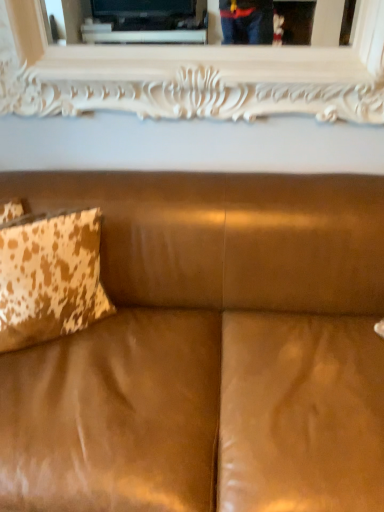
This screenshot has width=384, height=512. Describe the element at coordinates (50, 277) in the screenshot. I see `cowhide-patterned pillow at left` at that location.

Identify the location of white carved wood picture frame at upper center. The image size is (384, 512). (190, 74).

Is suede brown couch at center facing away from cowhide-patterned pillow at left?

Absolutely, suede brown couch at center is directed away from cowhide-patterned pillow at left.

From a real-world perspective, is suede brown couch at center positioned over cowhide-patterned pillow at left based on gravity?

Actually, suede brown couch at center is physically below cowhide-patterned pillow at left in the real world.

Is suede brown couch at center positioned beyond the bounds of cowhide-patterned pillow at left?

Yes, suede brown couch at center is not within cowhide-patterned pillow at left.

Which point is more forward, (149, 279) or (1, 293)?

The point (1, 293) is more forward.

Based on the photo, is cowhide-patterned pillow at left bigger than white carved wood picture frame at upper center?

No, cowhide-patterned pillow at left is not bigger than white carved wood picture frame at upper center.

Is point (27, 327) positioned after point (213, 58)?

No.

Is cowhide-patterned pillow at left behind white carved wood picture frame at upper center?

No, cowhide-patterned pillow at left is closer to the camera.

From the image's perspective, is cowhide-patterned pillow at left above white carved wood picture frame at upper center?

No, from the image's perspective, cowhide-patterned pillow at left is not over white carved wood picture frame at upper center.

Is suede brown couch at center beside white carved wood picture frame at upper center?

suede brown couch at center is not next to white carved wood picture frame at upper center, and they're not touching.

Does suede brown couch at center appear on the left side of white carved wood picture frame at upper center?

Indeed, suede brown couch at center is positioned on the left side of white carved wood picture frame at upper center.

Find the location of a particular element. The height and width of the screenshot is (512, 384). studio couch on the left of white carved wood picture frame at upper center is located at coordinates (208, 350).

Which is behind, cowhide-patterned pillow at left or suede brown couch at center?

cowhide-patterned pillow at left is behind.

Which is in front, point (72, 301) or point (336, 309)?

The point (72, 301) is closer.

In the scene shown: Is cowhide-patterned pillow at left facing away from suede brown couch at center?

Yes.

Which of these two, white carved wood picture frame at upper center or suede brown couch at center, stands taller?

suede brown couch at center.

Considering the relative sizes of white carved wood picture frame at upper center and suede brown couch at center in the image provided, is white carved wood picture frame at upper center smaller than suede brown couch at center?

Indeed, white carved wood picture frame at upper center has a smaller size compared to suede brown couch at center.

Is white carved wood picture frame at upper center to the right of suede brown couch at center from the viewer's perspective?

Indeed, white carved wood picture frame at upper center is positioned on the right side of suede brown couch at center.

Is white carved wood picture frame at upper center positioned with its back to suede brown couch at center?

No, white carved wood picture frame at upper center's orientation is not away from suede brown couch at center.

How distant is white carved wood picture frame at upper center from cowhide-patterned pillow at left?

white carved wood picture frame at upper center is 27.06 inches from cowhide-patterned pillow at left.

Is white carved wood picture frame at upper center inside or outside of cowhide-patterned pillow at left?

white carved wood picture frame at upper center exists outside the volume of cowhide-patterned pillow at left.

Is white carved wood picture frame at upper center positioned far away from cowhide-patterned pillow at left?

Actually, white carved wood picture frame at upper center and cowhide-patterned pillow at left are a little close together.

Find the location of a particular element. The height and width of the screenshot is (512, 384). pillow below the white carved wood picture frame at upper center (from the image's perspective) is located at coordinates (50, 277).

Where is `studio couch in front of the cowhide-patterned pillow at left`? studio couch in front of the cowhide-patterned pillow at left is located at coordinates (208, 350).

This screenshot has width=384, height=512. I want to click on picture frame located above the cowhide-patterned pillow at left (from a real-world perspective), so click(190, 74).

Estimate the real-world distances between objects in this image. Which object is further from white carved wood picture frame at upper center, cowhide-patterned pillow at left or suede brown couch at center?

The object further to white carved wood picture frame at upper center is cowhide-patterned pillow at left.

Which object lies further to the anchor point suede brown couch at center, cowhide-patterned pillow at left or white carved wood picture frame at upper center?

white carved wood picture frame at upper center is further to suede brown couch at center.

Estimate the real-world distances between objects in this image. Which object is closer to suede brown couch at center, white carved wood picture frame at upper center or cowhide-patterned pillow at left?

Among the two, cowhide-patterned pillow at left is located nearer to suede brown couch at center.

Looking at this image, from the image, which object appears to be nearer to white carved wood picture frame at upper center, suede brown couch at center or cowhide-patterned pillow at left?

suede brown couch at center.

Considering their positions, is white carved wood picture frame at upper center positioned further to cowhide-patterned pillow at left than suede brown couch at center?

white carved wood picture frame at upper center.

Estimate the real-world distances between objects in this image. Which object is closer to cowhide-patterned pillow at left, suede brown couch at center or white carved wood picture frame at upper center?

suede brown couch at center is positioned closer to the anchor cowhide-patterned pillow at left.

Where is `pillow between white carved wood picture frame at upper center and suede brown couch at center from top to bottom`? The image size is (384, 512). pillow between white carved wood picture frame at upper center and suede brown couch at center from top to bottom is located at coordinates (50, 277).